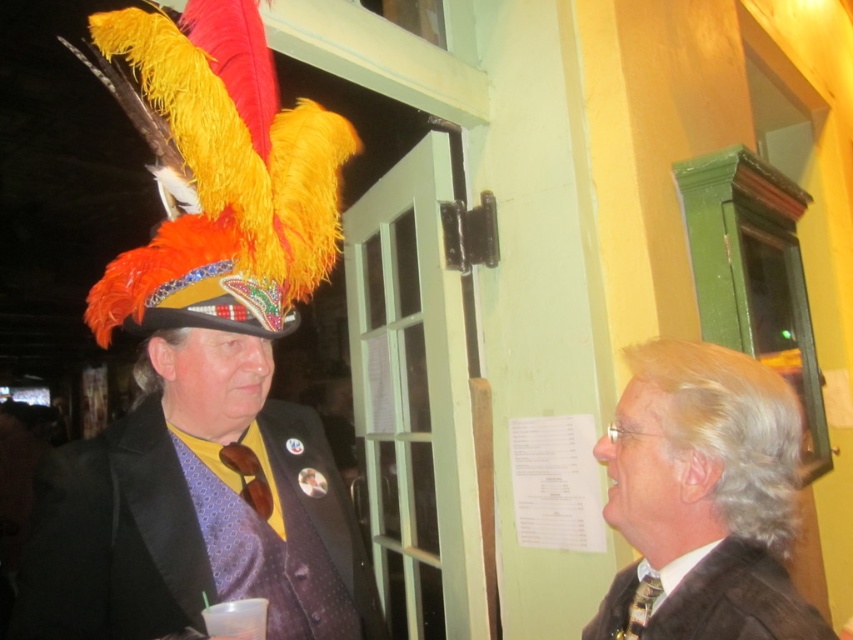
Does point (195, 506) come in front of point (741, 602)?

No, (195, 506) is behind (741, 602).

Which is more to the right, matte black suit at center or dark brown fabric business suit at right?

Positioned to the right is dark brown fabric business suit at right.

I want to click on matte black suit at center, so click(x=119, y=538).

Where is `matte black suit at center`? The image size is (853, 640). matte black suit at center is located at coordinates (119, 538).

Does matte black suit at right appear on the left side of dark brown fabric business suit at right?

No, matte black suit at right is not to the left of dark brown fabric business suit at right.

Who is higher up, matte black suit at right or dark brown fabric business suit at right?

Positioned higher is matte black suit at right.

Is point (701, 445) in front of point (723, 589)?

No.

Locate an element on the screen. matte black suit at right is located at coordinates (709, 490).

Which is behind, point (323, 170) or point (791, 509)?

Positioned behind is point (323, 170).

What do you see at coordinates (219, 176) in the screenshot?
I see `feathered headdress at upper left` at bounding box center [219, 176].

The height and width of the screenshot is (640, 853). Find the location of `feathered headdress at upper left`. feathered headdress at upper left is located at coordinates pyautogui.click(x=219, y=176).